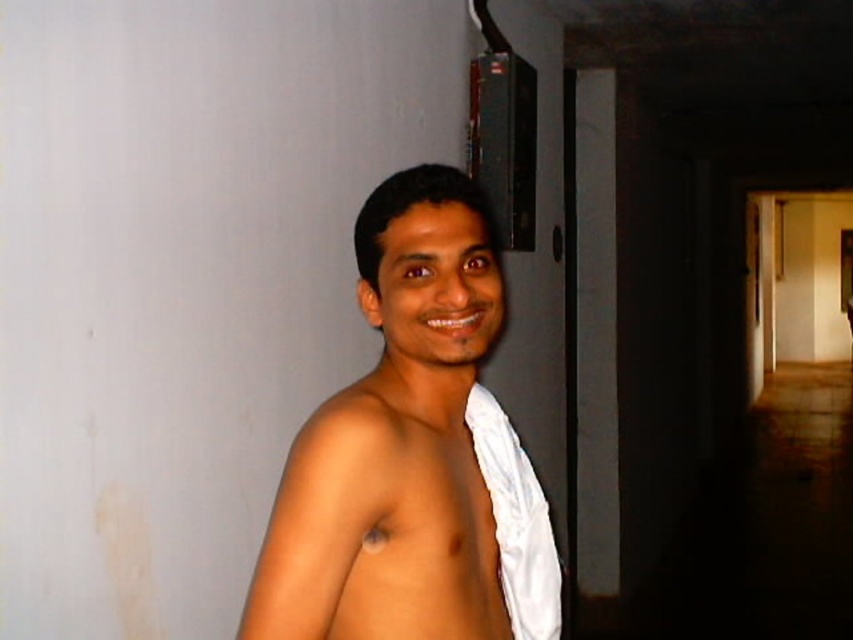
Is point (315, 468) closer to camera compared to point (498, 424)?

Yes, point (315, 468) is closer to viewer.

The height and width of the screenshot is (640, 853). What do you see at coordinates (412, 452) in the screenshot?
I see `white cloth at center` at bounding box center [412, 452].

Is point (279, 486) closer to viewer compared to point (492, 445)?

That is True.

The width and height of the screenshot is (853, 640). What are the coordinates of `white cloth at center` in the screenshot? It's located at (412, 452).